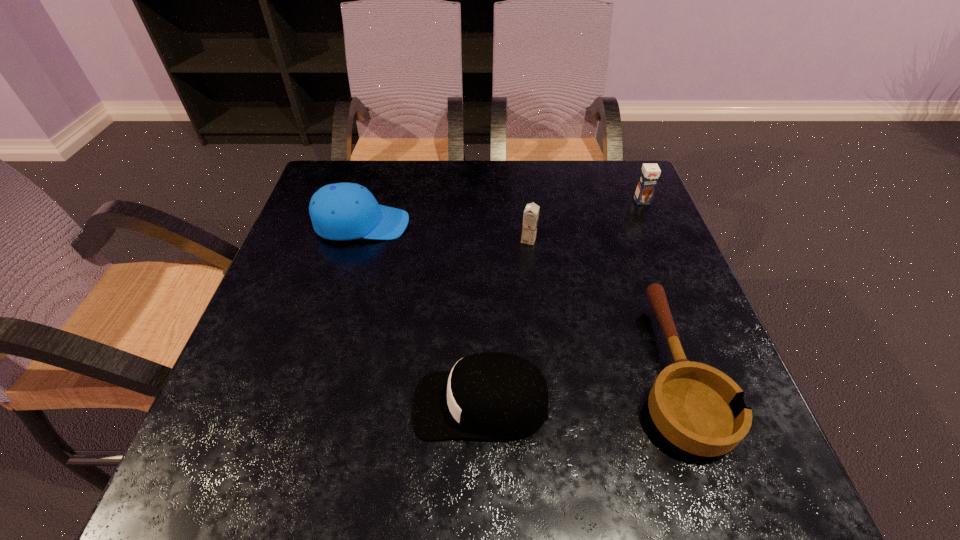
Find the location of a particular element. the leftmost object is located at coordinates (342, 211).

At what (x,y) coordinates should I click in order to perform the action: click on the farther cap. Please return your answer as a coordinate pair (x, y). Image resolution: width=960 pixels, height=540 pixels. Looking at the image, I should click on (342, 211).

Where is `the farthest object`? the farthest object is located at coordinates (649, 175).

This screenshot has width=960, height=540. In order to click on the farther chocolate milk in this screenshot , I will do `click(649, 175)`.

Where is `the nearer chocolate milk`? The width and height of the screenshot is (960, 540). the nearer chocolate milk is located at coordinates (531, 213).

Where is `the right cap`? Image resolution: width=960 pixels, height=540 pixels. the right cap is located at coordinates (491, 395).

You are a GUI agent. You are given a task and a screenshot of the screen. Output one action in this format:
    pyautogui.click(x=<x>, y=<y>)
    Task: Click on the shortest object
    
    Given the screenshot: What is the action you would take?
    pyautogui.click(x=698, y=408)

Image resolution: width=960 pixels, height=540 pixels. Find the location of `blank space located 0.220m on the front-facing side of the leftmost object`. blank space located 0.220m on the front-facing side of the leftmost object is located at coordinates (498, 224).

The image size is (960, 540). I want to click on free space located 0.230m on the front label of the farthest object, so click(670, 267).

The image size is (960, 540). What are the coordinates of `free location located on the front of the nearer chocolate milk` in the screenshot? It's located at (539, 331).